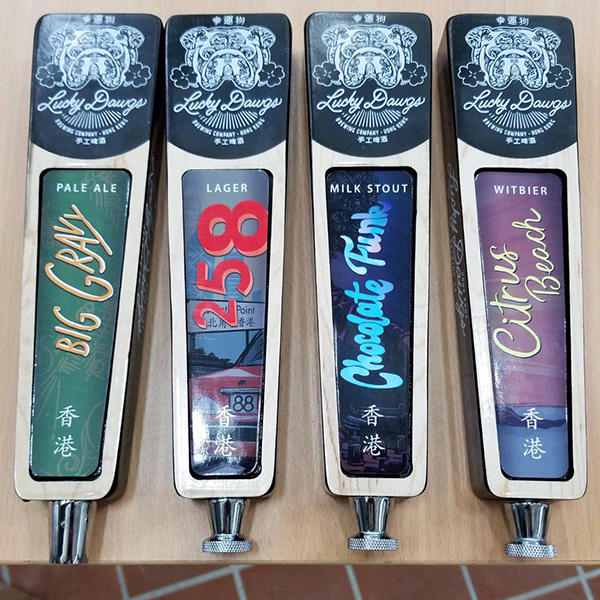
Identify the location of beer tap handles. (76, 323), (226, 339), (388, 339), (526, 353).